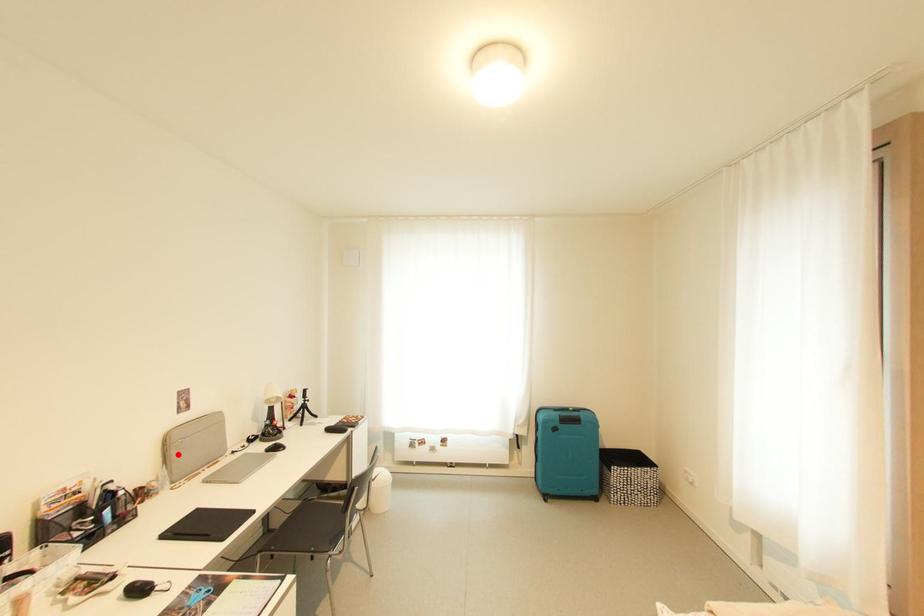
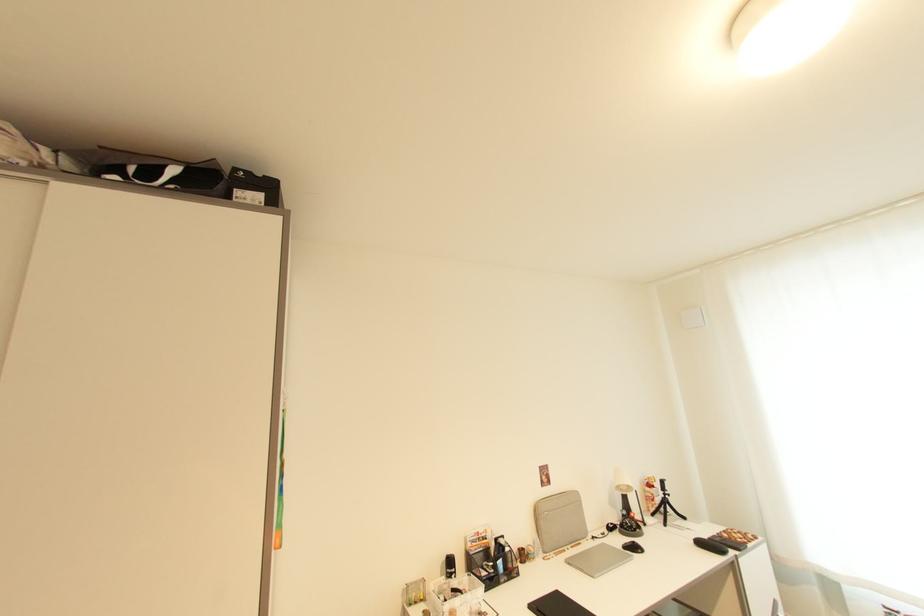
Question: I am providing you with two images of the same scene from different viewpoints. Image1 has a red point marked. In image2, the corresponding 3D location appears at what relative position? Reply with the corresponding letter.

Choices:
 (A) Closer
 (B) Farther

Answer: (B)